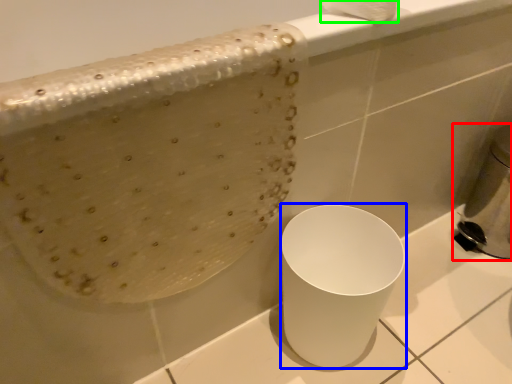
Question: Which object is the farthest from appliance (highlighted by a red box)? Choose among these: porcelain (highlighted by a blue box) or toilet paper (highlighted by a green box).

Choices:
 (A) porcelain
 (B) toilet paper

Answer: (B)